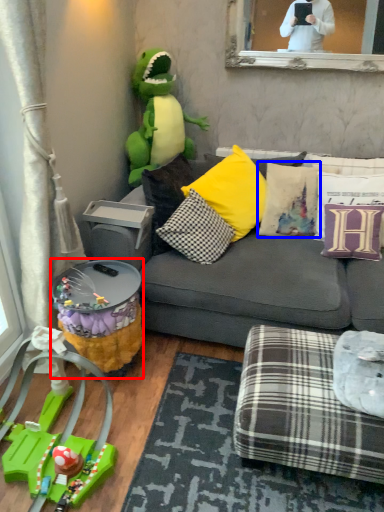
Question: Among these objects, which one is nearest to the camera, side table (highlighted by a red box) or pillow (highlighted by a blue box)?

Choices:
 (A) side table
 (B) pillow

Answer: (A)